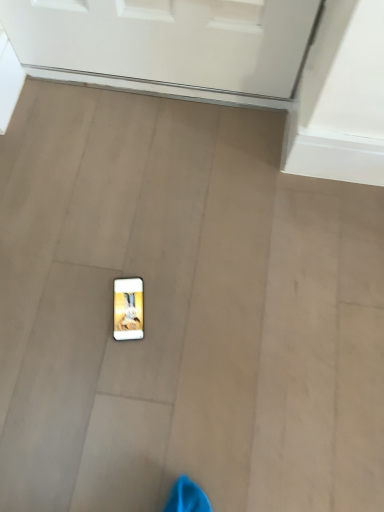
You are a GUI agent. You are given a task and a screenshot of the screen. Output one action in this format:
    pyautogui.click(x=<x>, y=<y>)
    Task: Click on the free space in front of matte white phone at center
    
    Given the screenshot: What is the action you would take?
    pyautogui.click(x=120, y=377)